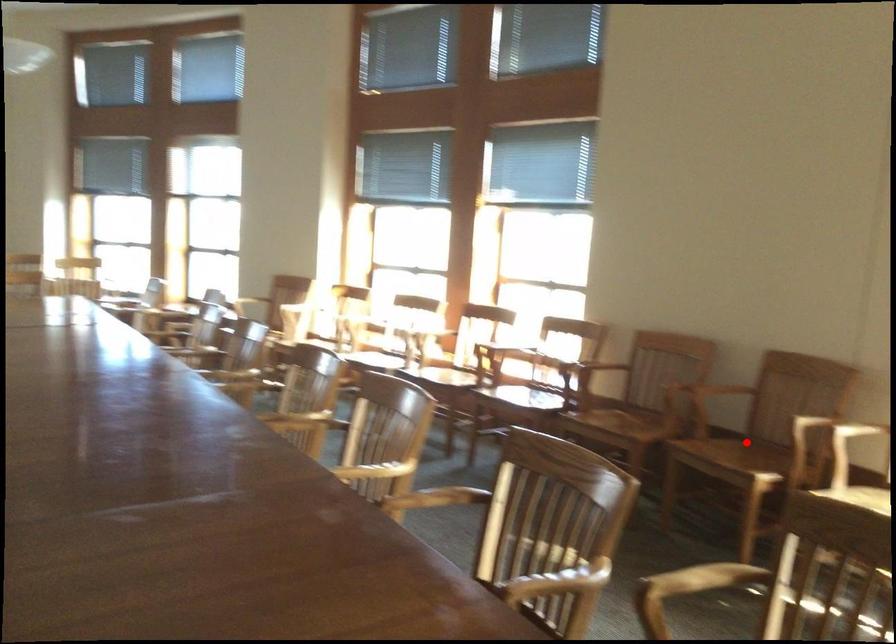
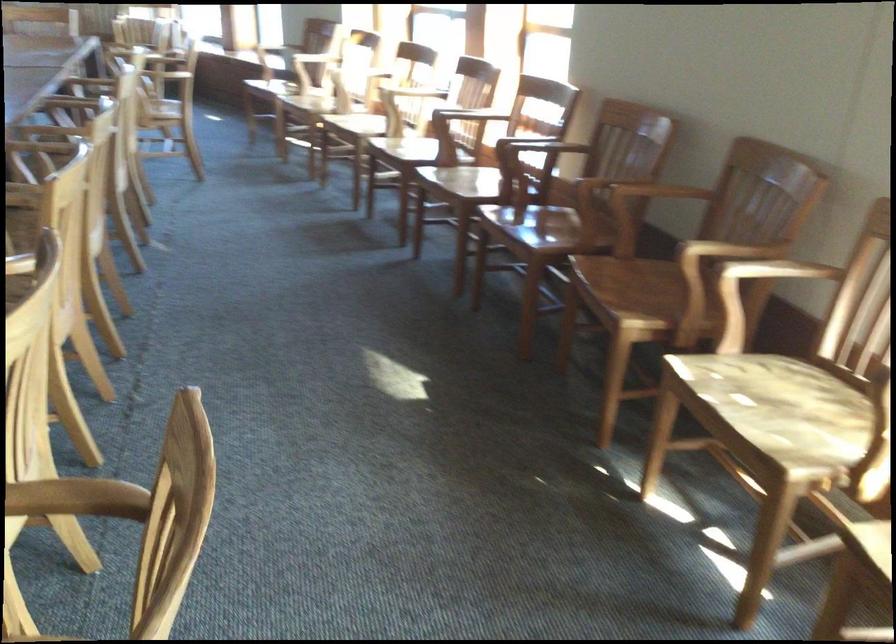
Where in the second image is the point corresponding to the highlighted location from the first image?

(650, 283)